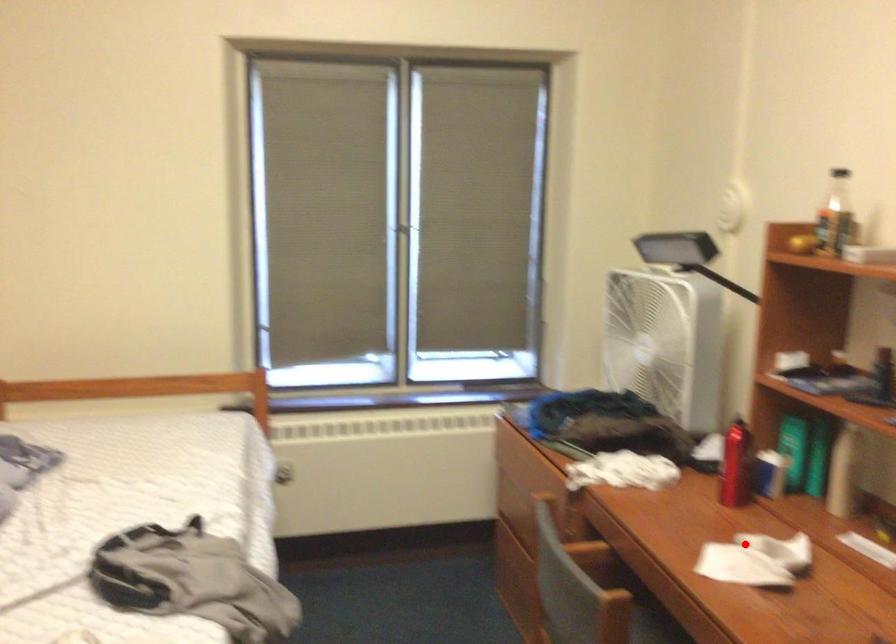
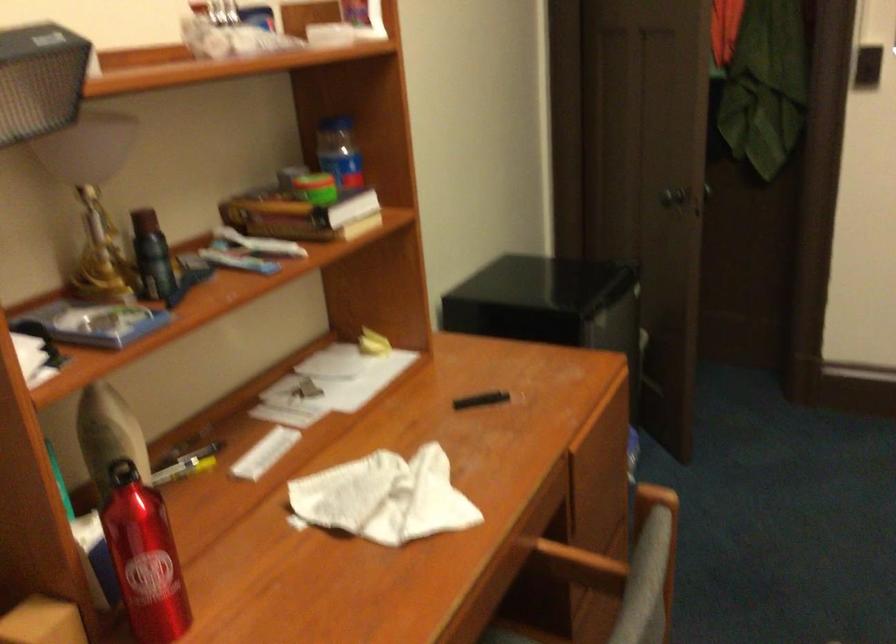
Question: I am providing you with two images of the same scene from different viewpoints. A red point is marked on the first image. Is the red point's position out of view in image 2?

Choices:
 (A) Yes
 (B) No

Answer: (B)